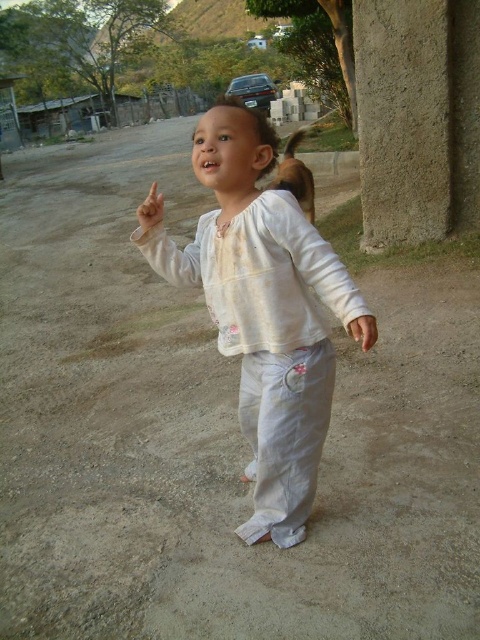
Question: Which of the following is the farthest from the observer?

Choices:
 (A) (157, 218)
 (B) (276, 518)

Answer: (B)

Question: Is white cotton baby at center to the right of light beige fabric hand at upper center from the viewer's perspective?

Choices:
 (A) no
 (B) yes

Answer: (B)

Question: Which object appears farthest from the camera in this image?

Choices:
 (A) light beige fabric hand at upper center
 (B) white cotton baby at center

Answer: (A)

Question: Does white cotton baby at center lie in front of light beige fabric hand at upper center?

Choices:
 (A) no
 (B) yes

Answer: (B)

Question: Does white cotton baby at center have a smaller size compared to light beige fabric hand at upper center?

Choices:
 (A) no
 (B) yes

Answer: (B)